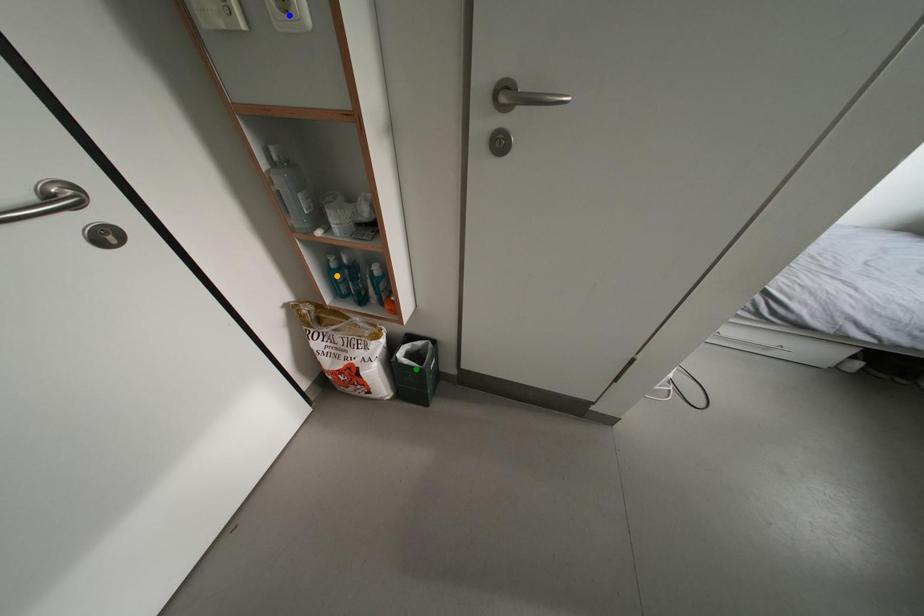
Order these from nearest to farthest:
green point, blue point, orange point

blue point → orange point → green point